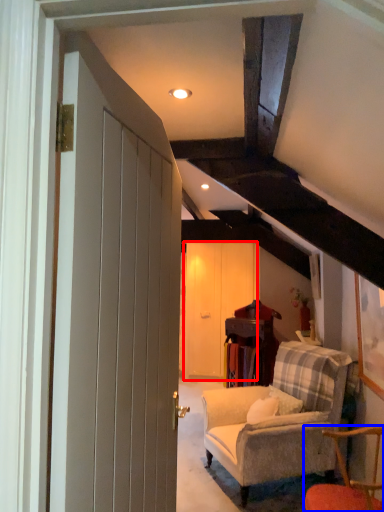
Question: Which point is closer to the camera, barn door (highlighted by a red box) or chair (highlighted by a blue box)?

Choices:
 (A) barn door
 (B) chair

Answer: (B)